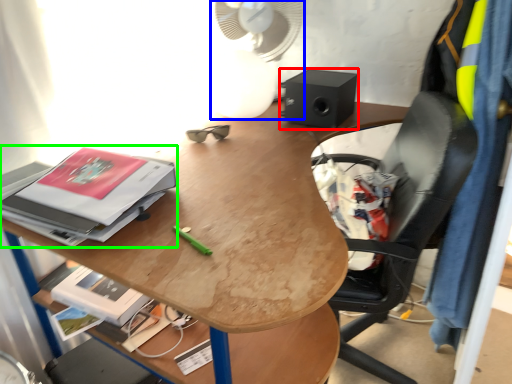
Question: Which object is positioned closest to loudspeaker (highlighted by a red box)? Select from mechanical fan (highlighted by a blue box) and paperback book (highlighted by a green box).

Choices:
 (A) mechanical fan
 (B) paperback book

Answer: (A)